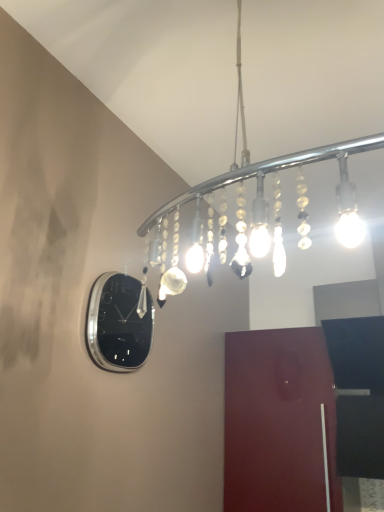
This screenshot has height=512, width=384. What do you see at coordinates (279, 422) in the screenshot?
I see `glossy wood door at lower right` at bounding box center [279, 422].

Find the location of a particular element. The height and width of the screenshot is (512, 384). polished silver clock at upper left is located at coordinates (118, 323).

Find the location of a particular element. The height and width of the screenshot is (512, 384). glossy wood door at lower right is located at coordinates (x=279, y=422).

Are polished silver clock at upper left and glossy wood door at lower right located far from each other?

No, polished silver clock at upper left is in close proximity to glossy wood door at lower right.

From a real-world perspective, is polished silver clock at upper left above or below glossy wood door at lower right?

In terms of real-world spatial position, polished silver clock at upper left is above glossy wood door at lower right.

Between point (127, 342) and point (247, 488), which one is positioned in front?

The point (127, 342) is closer to the camera.

In the scene shown: From their relative heights in the image, would you say polished silver clock at upper left is taller or shorter than clear glass chandelier at upper center?

polished silver clock at upper left is shorter than clear glass chandelier at upper center.

How many degrees apart are the facing directions of polished silver clock at upper left and clear glass chandelier at upper center?

90.5 degrees.

Is polished silver clock at upper left oriented away from clear glass chandelier at upper center?

No, clear glass chandelier at upper center is not at the back of polished silver clock at upper left.

Can you confirm if polished silver clock at upper left is positioned to the right of clear glass chandelier at upper center?

No.

From the image's perspective, between clear glass chandelier at upper center and polished silver clock at upper left, which one is located above?

clear glass chandelier at upper center is shown above in the image.

Which object is positioned more to the right, clear glass chandelier at upper center or polished silver clock at upper left?

From the viewer's perspective, clear glass chandelier at upper center appears more on the right side.

Does clear glass chandelier at upper center have a greater width compared to polished silver clock at upper left?

Correct, the width of clear glass chandelier at upper center exceeds that of polished silver clock at upper left.

Which is less distant, (x=235, y=263) or (x=110, y=305)?

Point (x=235, y=263) appears to be farther away from the viewer than point (x=110, y=305).

Is glossy wood door at lower right placed right next to polished silver clock at upper left?

There is a gap between glossy wood door at lower right and polished silver clock at upper left.

From a real-world perspective, is glossy wood door at lower right positioned over polished silver clock at upper left based on gravity?

No, from a real-world perspective, glossy wood door at lower right is not above polished silver clock at upper left.

From the image's perspective, which one is positioned higher, glossy wood door at lower right or polished silver clock at upper left?

polished silver clock at upper left.

Is polished silver clock at upper left surrounded by glossy wood door at lower right?

No, polished silver clock at upper left is not surrounded by glossy wood door at lower right.

Considering the sizes of objects clear glass chandelier at upper center and glossy wood door at lower right in the image provided, who is bigger, clear glass chandelier at upper center or glossy wood door at lower right?

With larger size is clear glass chandelier at upper center.

In the scene shown: From the image's perspective, is clear glass chandelier at upper center located above or below glossy wood door at lower right?

Clearly, from the image's perspective, clear glass chandelier at upper center is above glossy wood door at lower right.

Can you confirm if clear glass chandelier at upper center is positioned to the right of glossy wood door at lower right?

Incorrect, clear glass chandelier at upper center is not on the right side of glossy wood door at lower right.

Considering the points (299, 193) and (280, 407), which point is in front, point (299, 193) or point (280, 407)?

Point (280, 407)

Does point (274, 460) come in front of point (345, 142)?

No, it is not.

Is glossy wood door at lower right next to clear glass chandelier at upper center?

glossy wood door at lower right and clear glass chandelier at upper center are clearly separated.

Which is more to the left, glossy wood door at lower right or clear glass chandelier at upper center?

clear glass chandelier at upper center.

Where is `clock above the glossy wood door at lower right (from the image's perspective)`? Image resolution: width=384 pixels, height=512 pixels. clock above the glossy wood door at lower right (from the image's perspective) is located at coordinates (118, 323).

Where is `lamp in front of the polished silver clock at upper left`? lamp in front of the polished silver clock at upper left is located at coordinates (263, 185).

Based on their spatial positions, is polished silver clock at upper left or clear glass chandelier at upper center further from glossy wood door at lower right?

polished silver clock at upper left is positioned further to the anchor glossy wood door at lower right.

Considering their positions, is glossy wood door at lower right positioned further to clear glass chandelier at upper center than polished silver clock at upper left?

glossy wood door at lower right lies further to clear glass chandelier at upper center than the other object.

From the picture: Estimate the real-world distances between objects in this image. Which object is closer to polished silver clock at upper left, clear glass chandelier at upper center or glossy wood door at lower right?

clear glass chandelier at upper center lies closer to polished silver clock at upper left than the other object.

When comparing their distances from glossy wood door at lower right, does clear glass chandelier at upper center or polished silver clock at upper left seem closer?

Among the two, clear glass chandelier at upper center is located nearer to glossy wood door at lower right.

Based on their spatial positions, is polished silver clock at upper left or glossy wood door at lower right further from clear glass chandelier at upper center?

Based on the image, glossy wood door at lower right appears to be further to clear glass chandelier at upper center.

From the image, which object appears to be nearer to polished silver clock at upper left, glossy wood door at lower right or clear glass chandelier at upper center?

The object closer to polished silver clock at upper left is clear glass chandelier at upper center.

At what (x,y) coordinates should I click in order to perform the action: click on clock located between clear glass chandelier at upper center and glossy wood door at lower right in the depth direction. Please return your answer as a coordinate pair (x, y). The width and height of the screenshot is (384, 512). Looking at the image, I should click on (118, 323).